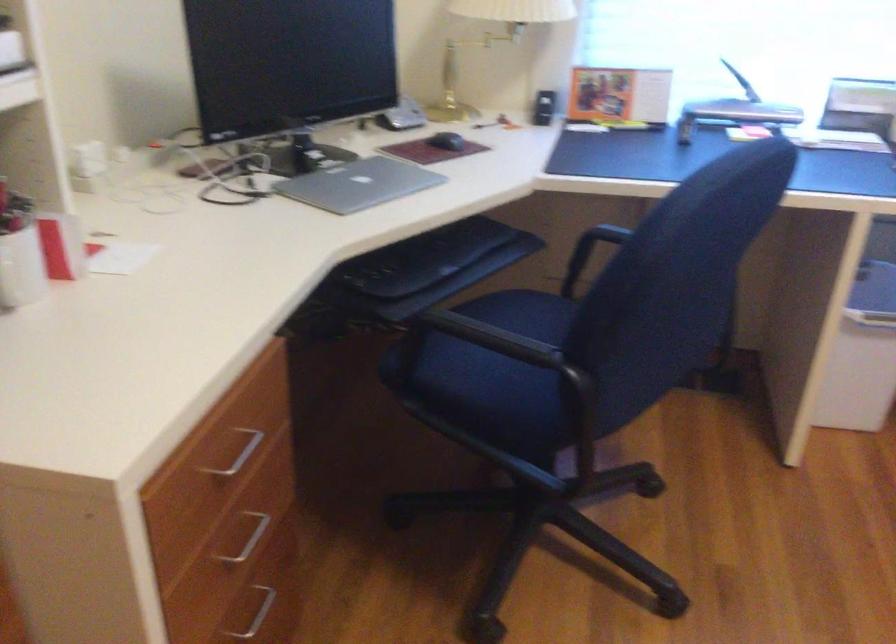
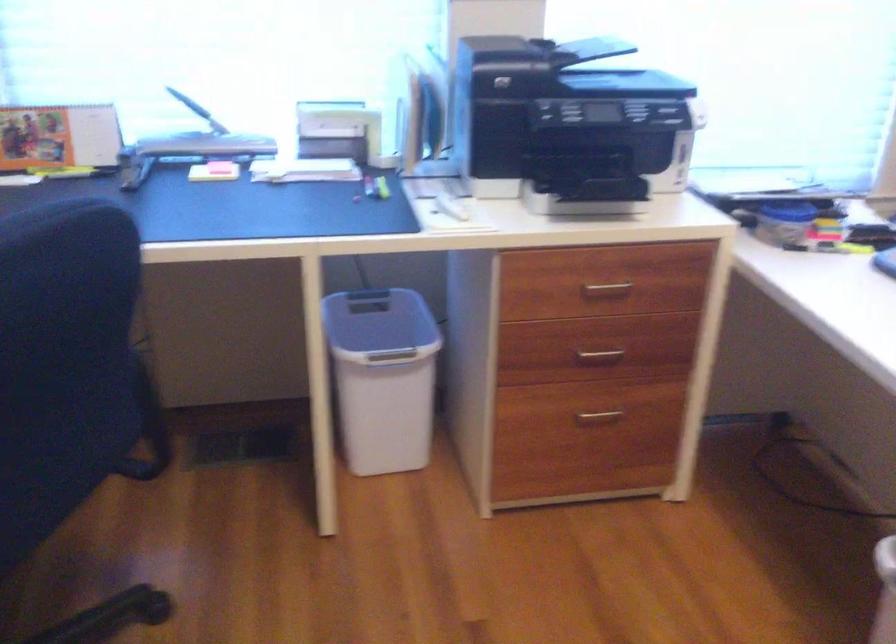
What movement of the cameraman would produce the second image?

The movement direction of the cameraman is right, forward.